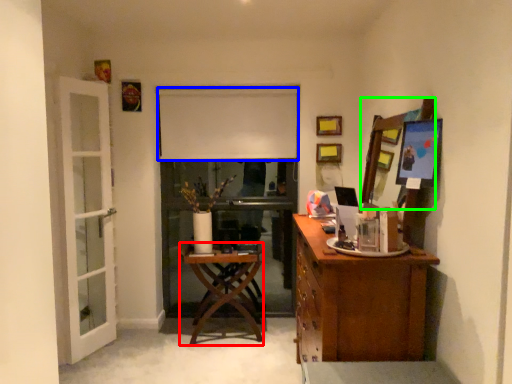
Question: Considering the real-world distances, which object is farthest from desk (highlighted by a red box)? curtain (highlighted by a blue box) or mirror (highlighted by a green box)?

Choices:
 (A) curtain
 (B) mirror

Answer: (B)